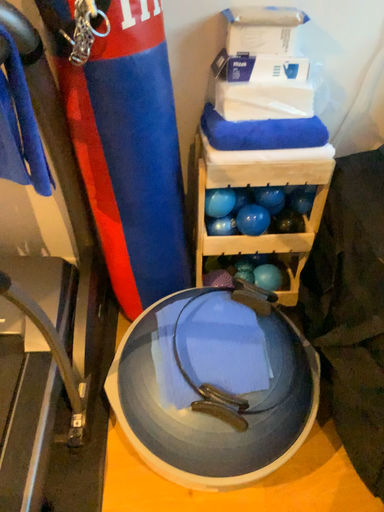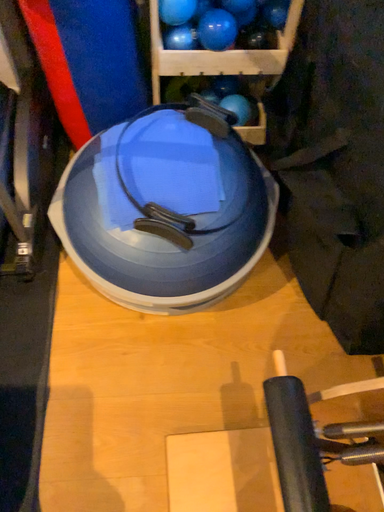
Question: Which way did the camera rotate in the video?

Choices:
 (A) rotated upward
 (B) rotated downward

Answer: (B)